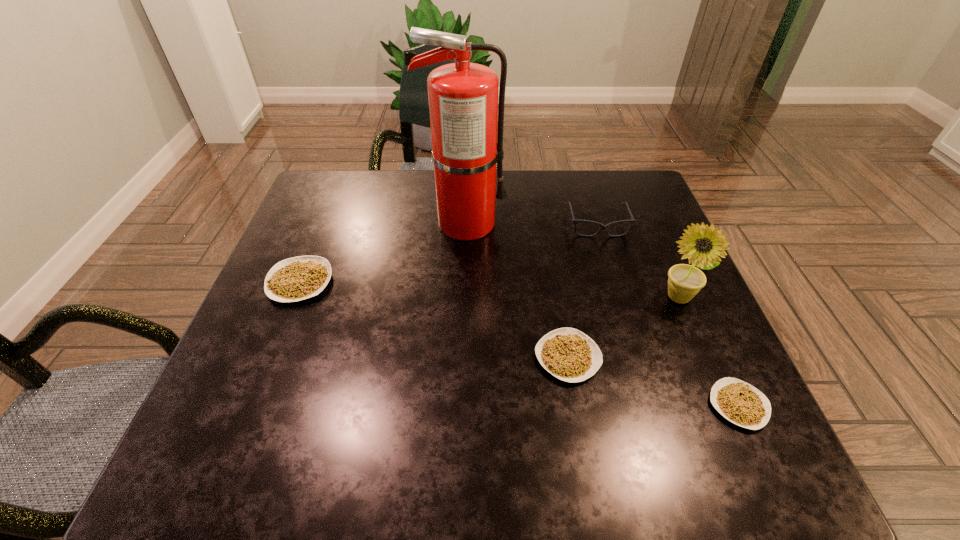
Find the location of a particular element. The width and height of the screenshot is (960, 540). spectacles located at the right edge is located at coordinates (602, 227).

Where is `sunflower at the right edge`? sunflower at the right edge is located at coordinates (685, 281).

The width and height of the screenshot is (960, 540). In order to click on object that is at the far right corner in this screenshot , I will do `click(602, 227)`.

Identify the location of object at the near right corner. (739, 402).

Locate an element on the screen. free space at the far edge of the desktop is located at coordinates (436, 204).

Identify the location of vacant space at the near edge. The image size is (960, 540). (563, 400).

Identify the location of free point at the left edge. The width and height of the screenshot is (960, 540). (335, 234).

This screenshot has height=540, width=960. I want to click on free space at the right edge of the desktop, so click(x=675, y=330).

Locate an element on the screen. The height and width of the screenshot is (540, 960). vacant space at the near left corner is located at coordinates (281, 403).

This screenshot has height=540, width=960. I want to click on vacant space at the far right corner, so click(x=620, y=173).